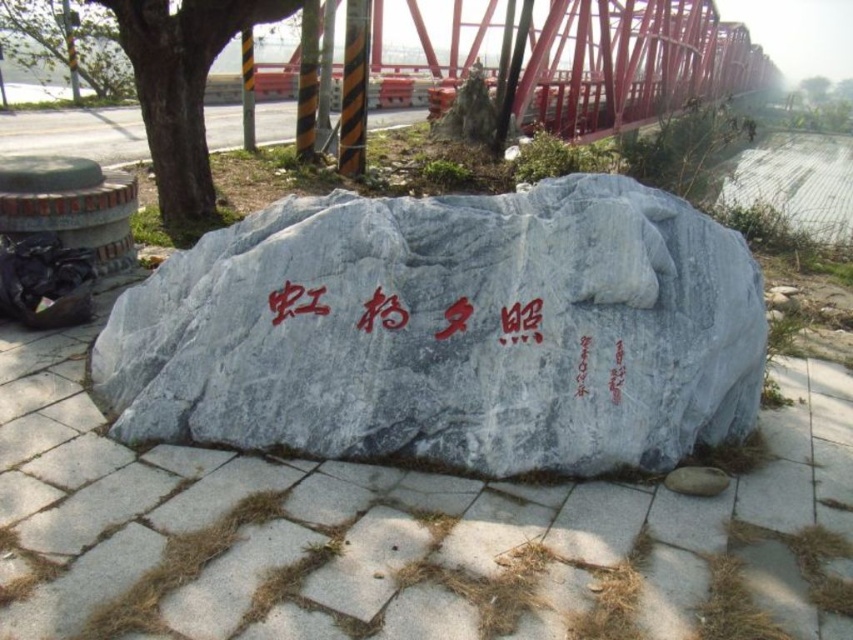
Question: Is gray stone pavement at center bigger than gray polished stone boulder at center?

Choices:
 (A) yes
 (B) no

Answer: (A)

Question: Can you confirm if gray stone pavement at center is positioned below gray polished stone boulder at center?

Choices:
 (A) yes
 (B) no

Answer: (A)

Question: Which of the following is the farthest from the observer?

Choices:
 (A) red stone writing at center
 (B) green leafy tree at left
 (C) gray stone pavement at center
 (D) gray polished stone boulder at center

Answer: (B)

Question: Can you confirm if gray stone pavement at center is positioned to the right of green leafy tree at left?

Choices:
 (A) no
 (B) yes

Answer: (B)

Question: Which object appears closest to the camera in this image?

Choices:
 (A) red stone writing at center
 (B) gray polished stone boulder at center

Answer: (B)

Question: Which of the following is the closest to the observer?

Choices:
 (A) (264, 435)
 (B) (604, 484)
 (C) (386, 314)

Answer: (B)